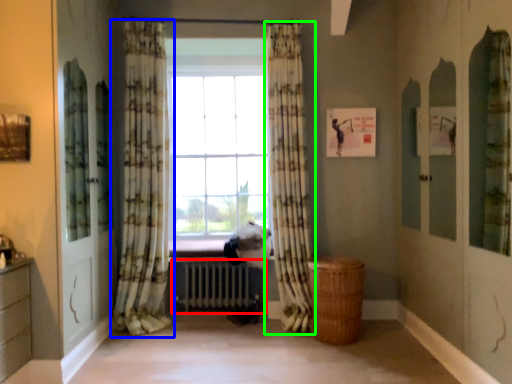
Question: Based on their relative distances, which object is nearer to radiator (highlighted by a red box)? Choose from curtain (highlighted by a blue box) and curtain (highlighted by a green box).

Choices:
 (A) curtain
 (B) curtain

Answer: (A)